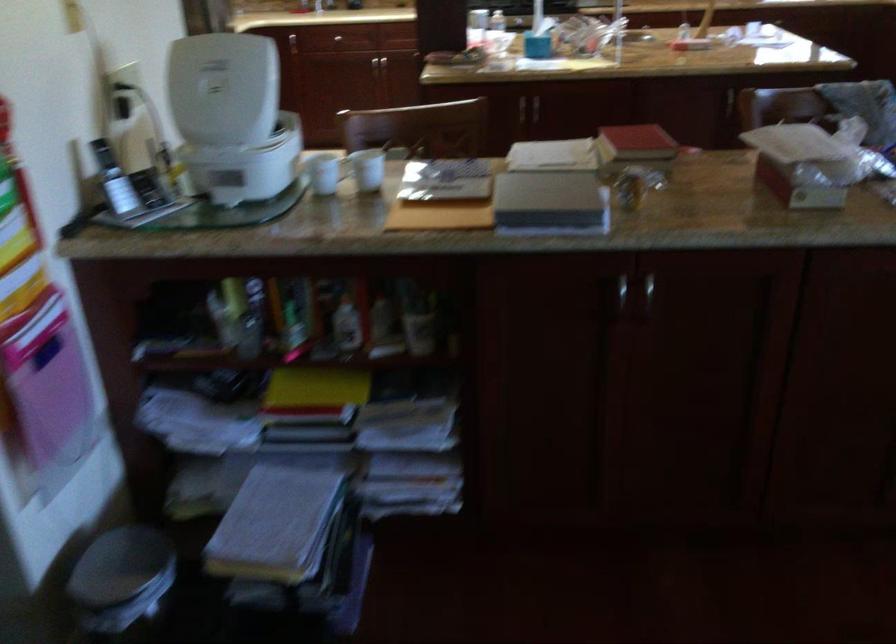
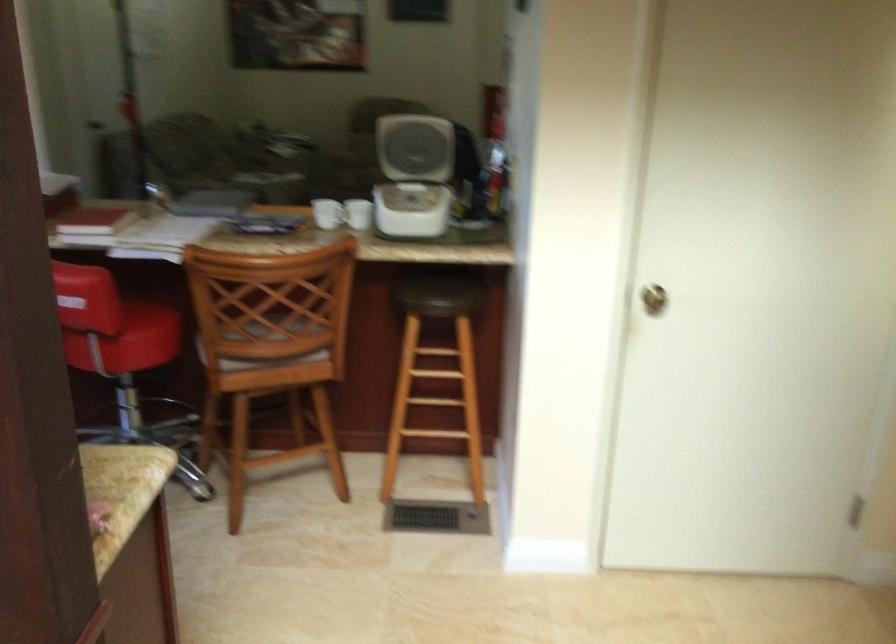
Where in the second image is the point corresponding to (220,86) from the first image?

(416, 137)